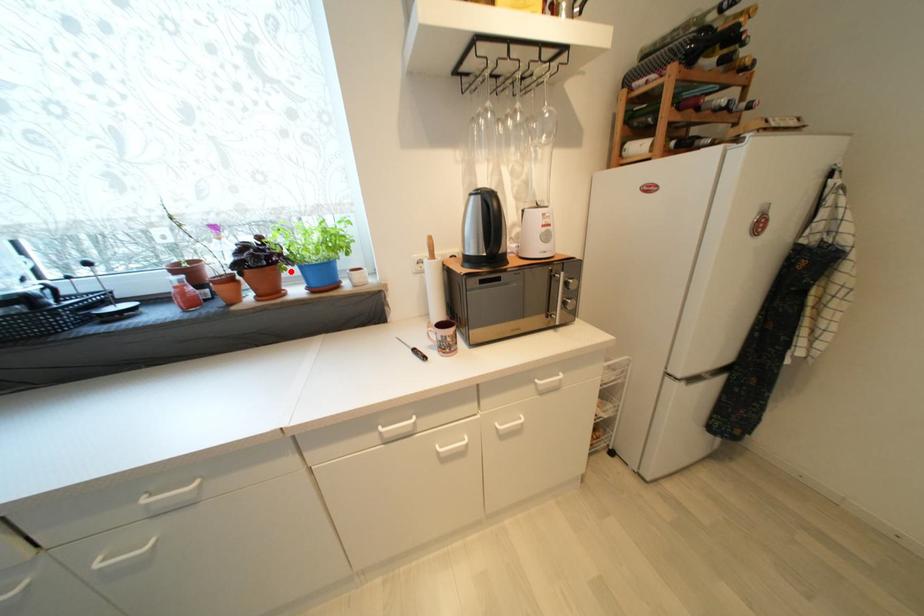
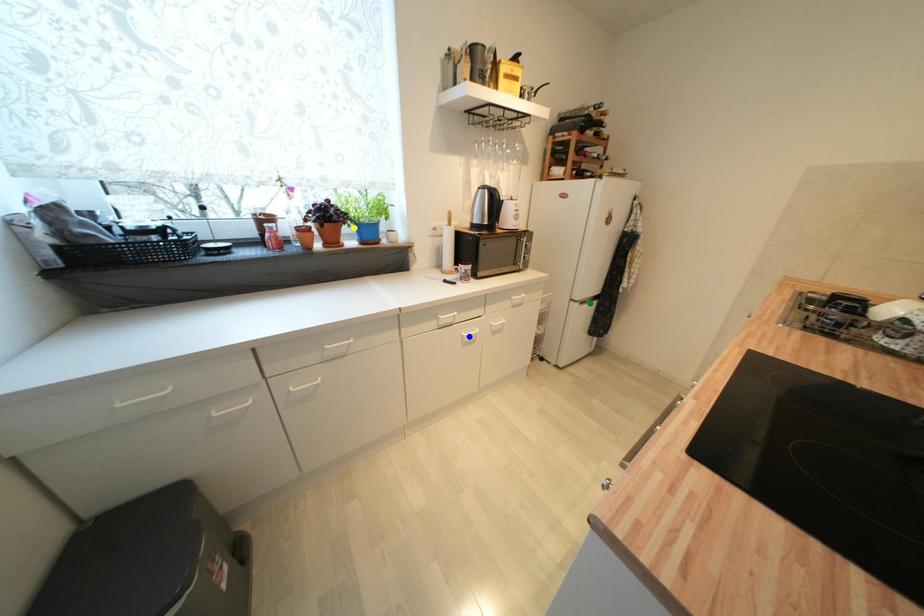
Question: I am providing you with two images of the same scene from different viewpoints. A red point is marked on the first image. You are given multiple points on the second image. Which spot in image 2 lines up with the point in image 1?

Choices:
 (A) yellow point
 (B) green point
 (C) blue point

Answer: (A)